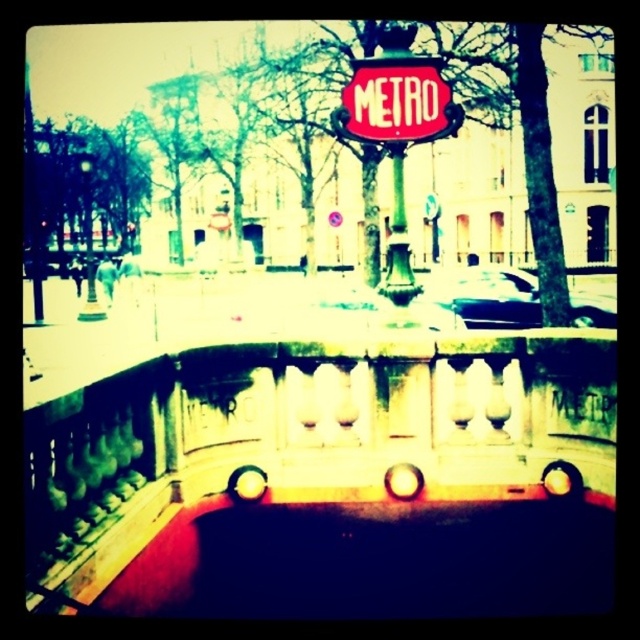
You are standing at the entrance of the vintage metro station and want to walk towards the METRO sign. There are two points marked on the ground in front of you. One is at point (x=497, y=372) and the other is at point (x=417, y=284). Which point should you step on first to reach the sign more directly?

You should step on point (x=497, y=372) first because it is in front of point (x=417, y=284), meaning it is closer to the METRO sign.

You are standing in front of the vintage metro entrance. You notice the red glossy metro sign at center and the green polished metal pole at center. Which object is located to the left of the other?

The red glossy metro sign at center is positioned on the left side of green polished metal pole at center.

You are a photographer trying to capture the METRO sign clearly. You notice the stone balustrade at center and the shiny black car at center are blocking your view. Which object should you move to the side to get a better shot of the sign?

The stone balustrade at center is thinner than the shiny black car at center, so moving the shiny black car at center would allow for a clearer view of the METRO sign since it is wider.